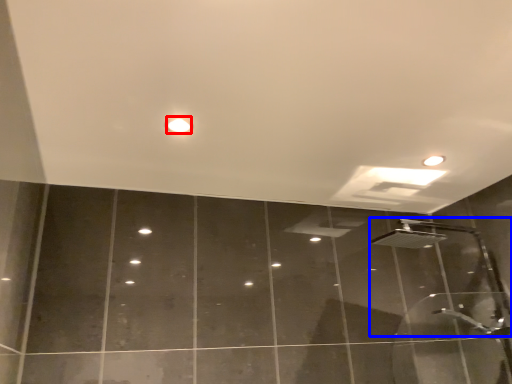
Question: Which of the following is the farthest to the observer, droplight (highlighted by a red box) or shower (highlighted by a blue box)?

Choices:
 (A) droplight
 (B) shower

Answer: (B)